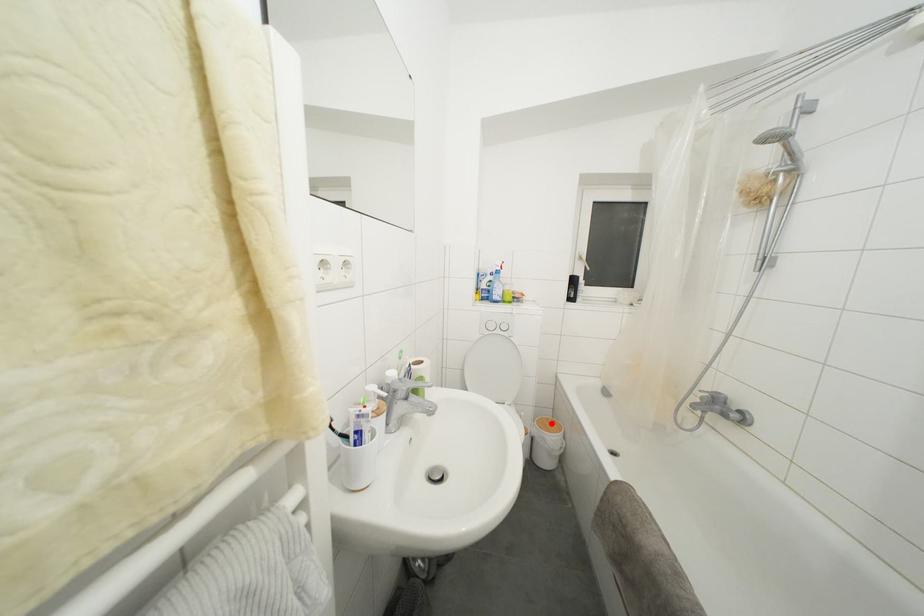
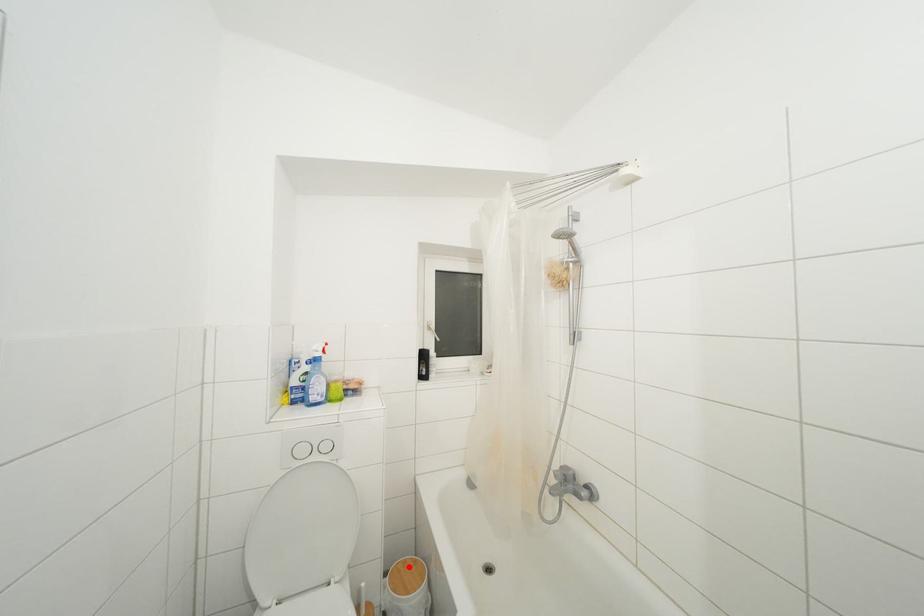
I am providing you with two images of the same scene from different viewpoints. A red point is marked on the first image and another point is marked on the second image. Is the marked point in image1 the same physical position as the marked point in image2?

Yes